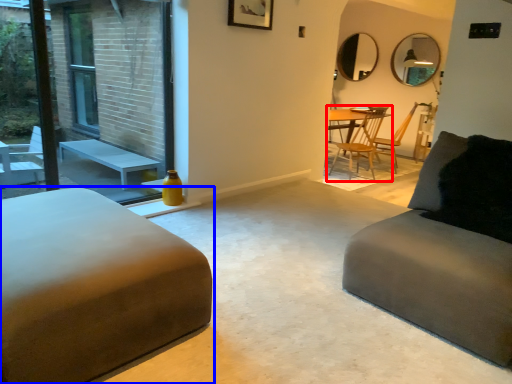
Question: Among these objects, which one is farthest to the camera, chair (highlighted by a red box) or studio couch (highlighted by a blue box)?

Choices:
 (A) chair
 (B) studio couch

Answer: (A)